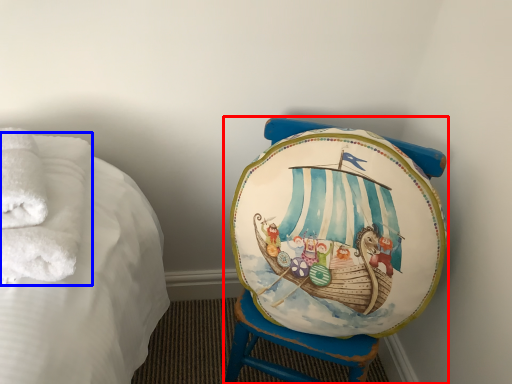
Question: Which point is closer to the camera, furniture (highlighted by a red box) or bath towel (highlighted by a blue box)?

Choices:
 (A) furniture
 (B) bath towel

Answer: (B)